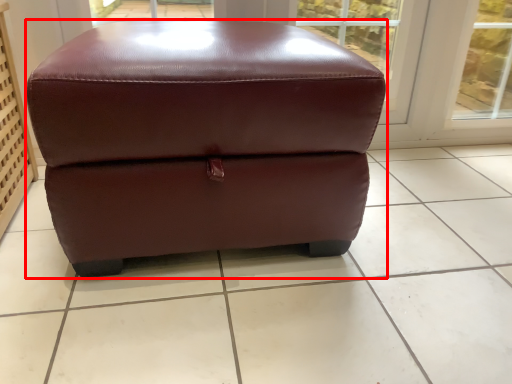
Question: From the image's perspective, considering the relative positions of furniture (annotated by the red box) and tile in the image provided, where is furniture (annotated by the red box) located with respect to the staircase?

Choices:
 (A) above
 (B) below

Answer: (A)